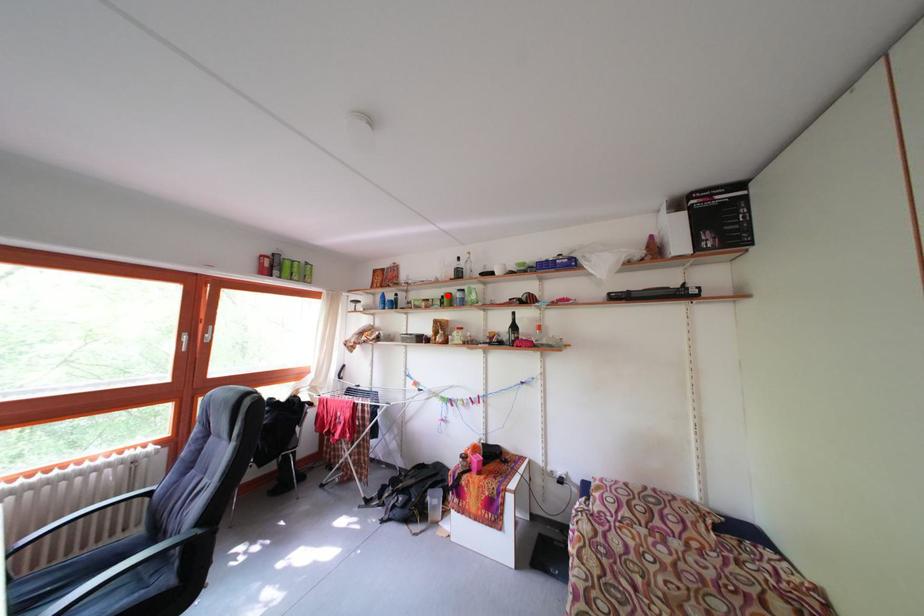
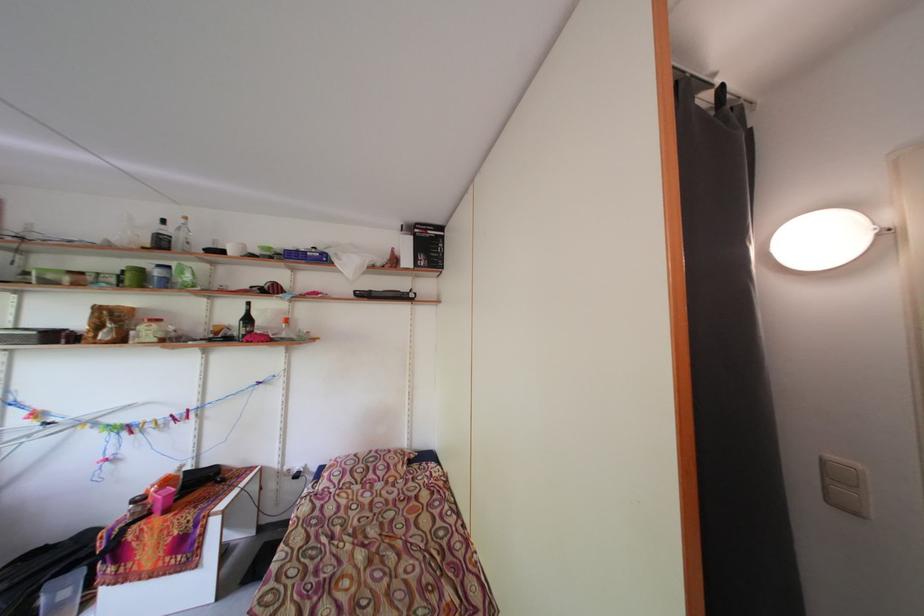
Question: I am providing you with two images of the same scene from different viewpoints. A red point is marked on the first image. Is the red point's position out of view in image 2?

Choices:
 (A) Yes
 (B) No

Answer: (B)